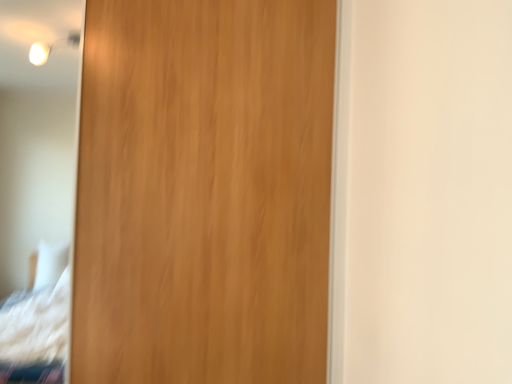
Describe the element at coordinates (203, 192) in the screenshot. I see `wooden door at center` at that location.

Image resolution: width=512 pixels, height=384 pixels. I want to click on wooden door at center, so click(x=203, y=192).

Identify the location of wooden door at center. Image resolution: width=512 pixels, height=384 pixels. (203, 192).